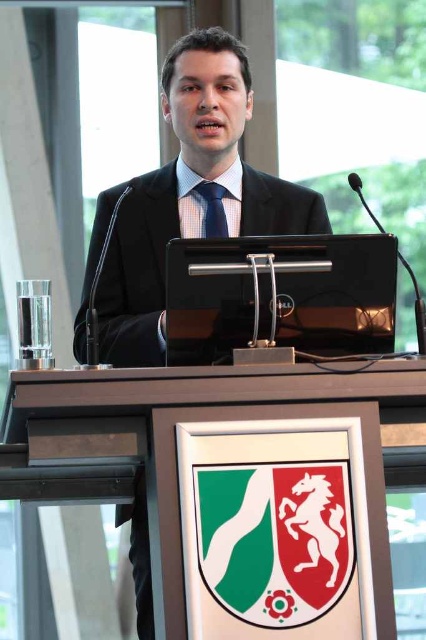
Does black suit at center appear on the left side of blue textured tie at center?

Incorrect, black suit at center is not on the left side of blue textured tie at center.

Is black suit at center taller than blue textured tie at center?

Yes.

Does point (218, 116) come farther from viewer compared to point (222, 193)?

No, it is not.

Where is `black suit at center`? Image resolution: width=426 pixels, height=640 pixels. black suit at center is located at coordinates (184, 198).

Is wooden podium at center smaller than black suit at center?

Yes.

Who is more distant from viewer, [291,515] or [250,106]?

The point [250,106] is behind.

The width and height of the screenshot is (426, 640). Identify the location of wooden podium at center. (238, 484).

Which of these two, wooden podium at center or blue textured tie at center, stands taller?

wooden podium at center

Does wooden podium at center lie behind blue textured tie at center?

No, wooden podium at center is in front of blue textured tie at center.

The image size is (426, 640). What do you see at coordinates (238, 484) in the screenshot? I see `wooden podium at center` at bounding box center [238, 484].

Identify the location of wooden podium at center. The height and width of the screenshot is (640, 426). (238, 484).